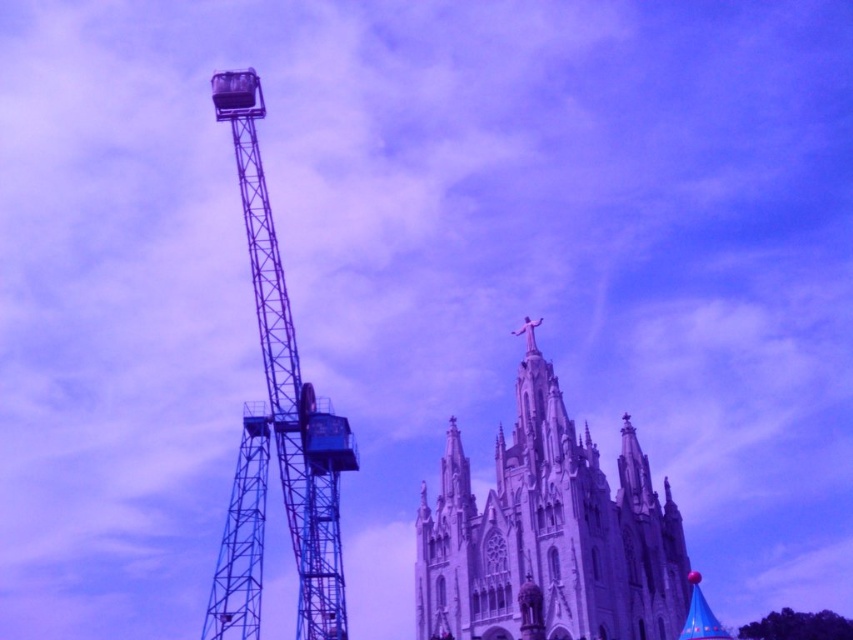
You are an architect planning to install a new lighting system. You need to determine which object, the white stone church at center or the metallic blue crane at left, requires more lights to cover its entire width. Based on the scene description, which object would need more lights?

The white stone church at center might be wider than metallic blue crane at left, so it would require more lights to cover its entire width.